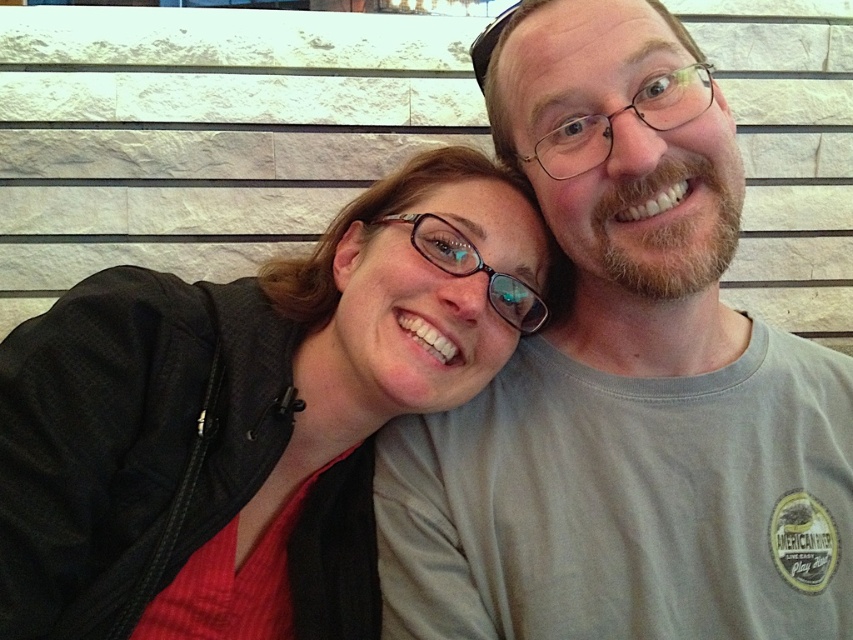
You are holding a 30 inch wide poster and want to place it on the wall so that it covers the point at point (114, 480). Can you fit the poster without exceeding the wall space?

The distance of point (114, 480) from viewer is 31.27 inches. Since the poster is 30 inches wide, it can be placed to cover the point as it is slightly narrower than the distance available.